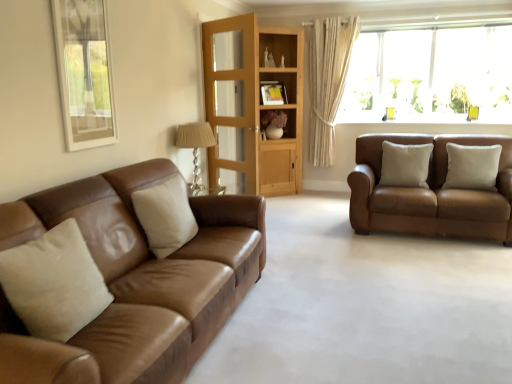
Question: Is brown leather couch at right, arranged as the second studio couch when viewed from the left, positioned with its back to matte brown shelf at center?

Choices:
 (A) no
 (B) yes

Answer: (A)

Question: Is brown leather couch at right, which is the 1th studio couch in back-to-front order, not within matte brown shelf at center?

Choices:
 (A) yes
 (B) no

Answer: (A)

Question: Is brown leather couch at right, which is the 1th studio couch in back-to-front order, aimed at matte brown shelf at center?

Choices:
 (A) no
 (B) yes

Answer: (A)

Question: Is brown leather couch at right, which is the 1th studio couch in back-to-front order, not close to matte brown shelf at center?

Choices:
 (A) yes
 (B) no

Answer: (A)

Question: From a real-world perspective, is brown leather couch at right, which is the 1th studio couch in back-to-front order, located higher than matte brown shelf at center?

Choices:
 (A) no
 (B) yes

Answer: (A)

Question: From the image's perspective, is brown leather couch at right, marked as the 2th studio couch in a front-to-back arrangement, below matte brown shelf at center?

Choices:
 (A) yes
 (B) no

Answer: (A)

Question: Does beige fabric curtain at upper right lie behind beige fabric pillow at left, the 1th pillow when ordered from left to right?

Choices:
 (A) yes
 (B) no

Answer: (A)

Question: Does beige fabric curtain at upper right have a larger size compared to beige fabric pillow at left, which is the 1th pillow in front-to-back order?

Choices:
 (A) no
 (B) yes

Answer: (B)

Question: Is beige fabric curtain at upper right wider than beige fabric pillow at left, which is the 1th pillow in front-to-back order?

Choices:
 (A) no
 (B) yes

Answer: (A)

Question: Considering the relative sizes of beige fabric curtain at upper right and beige fabric pillow at left, the 1th pillow when ordered from left to right, in the image provided, is beige fabric curtain at upper right thinner than beige fabric pillow at left, the 1th pillow when ordered from left to right,?

Choices:
 (A) no
 (B) yes

Answer: (B)

Question: From the image's perspective, is beige fabric curtain at upper right located beneath beige fabric pillow at left, the 1th pillow when ordered from left to right?

Choices:
 (A) no
 (B) yes

Answer: (A)

Question: Is beige fabric curtain at upper right positioned beyond the bounds of beige fabric pillow at left, the 1th pillow when ordered from left to right?

Choices:
 (A) yes
 (B) no

Answer: (A)

Question: Is beige fabric pillow at left, which is the 1th pillow in front-to-back order, not inside beige leather pillow at left, the 2th pillow when ordered from front to back?

Choices:
 (A) no
 (B) yes

Answer: (B)